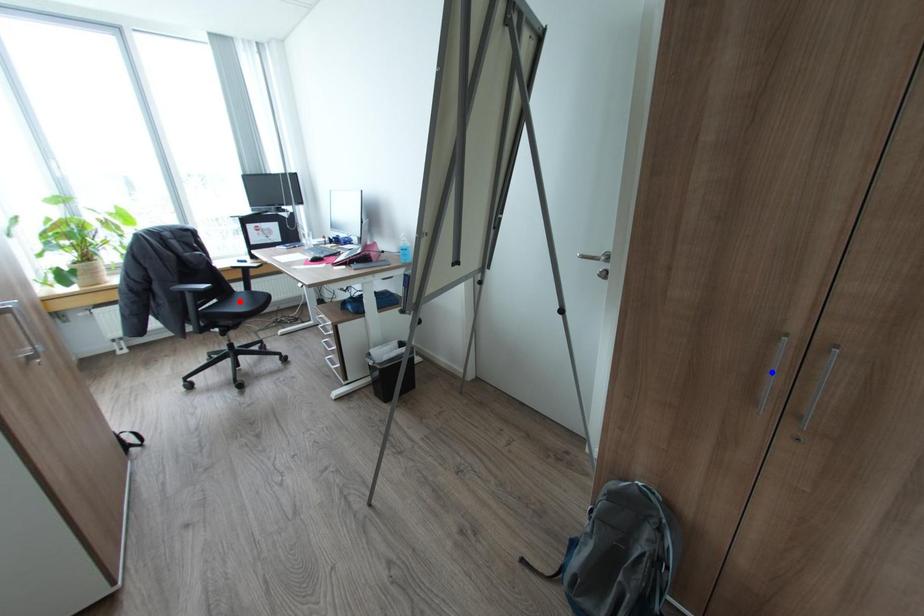
Question: Which of the two points in the image is closer to the camera?

Choices:
 (A) Blue point is closer.
 (B) Red point is closer.

Answer: (A)